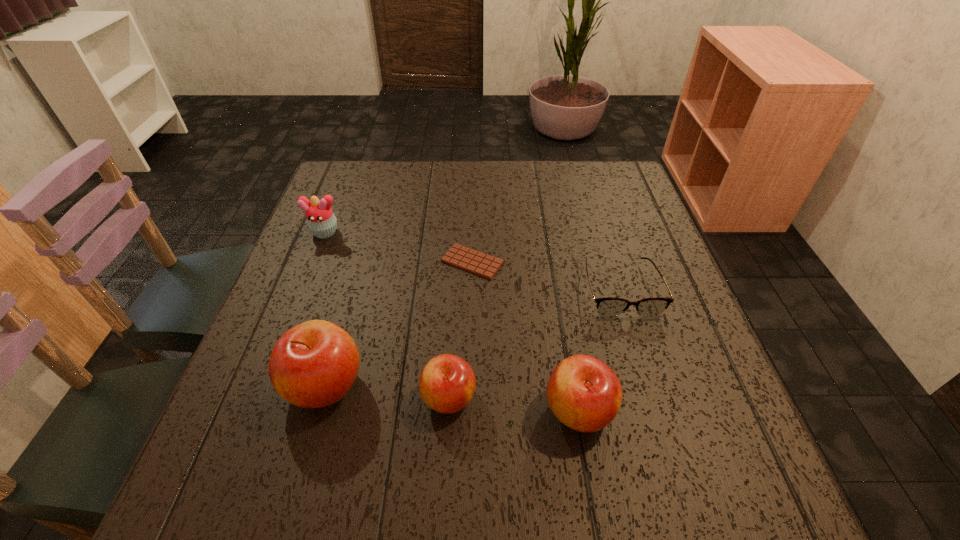
Locate an element on the screen. The image size is (960, 540). vacant space located on the left of the second tallest apple is located at coordinates (498, 410).

What are the coordinates of `vacant area situated on the face of the spectacles` in the screenshot? It's located at (654, 399).

Find the location of a particular element. The width and height of the screenshot is (960, 540). blank space located 0.050m on the face of the cupcake is located at coordinates (316, 255).

Where is `vacant space located on the front of the shortest object`? vacant space located on the front of the shortest object is located at coordinates (469, 410).

Where is `apple located at the left edge`? This screenshot has width=960, height=540. apple located at the left edge is located at coordinates (314, 364).

In order to click on cupcake that is at the left edge in this screenshot , I will do `click(321, 221)`.

At what (x,y) coordinates should I click in order to perform the action: click on object positioned at the right edge. Please return your answer as a coordinate pair (x, y). Image resolution: width=960 pixels, height=540 pixels. Looking at the image, I should click on (610, 306).

Find the location of a particular element. The image size is (960, 540). object located at the near left corner is located at coordinates (314, 364).

The height and width of the screenshot is (540, 960). Identify the location of blank space at the far edge. (533, 171).

In the image, there is a desktop. Where is `vacant space at the near edge`? vacant space at the near edge is located at coordinates (529, 428).